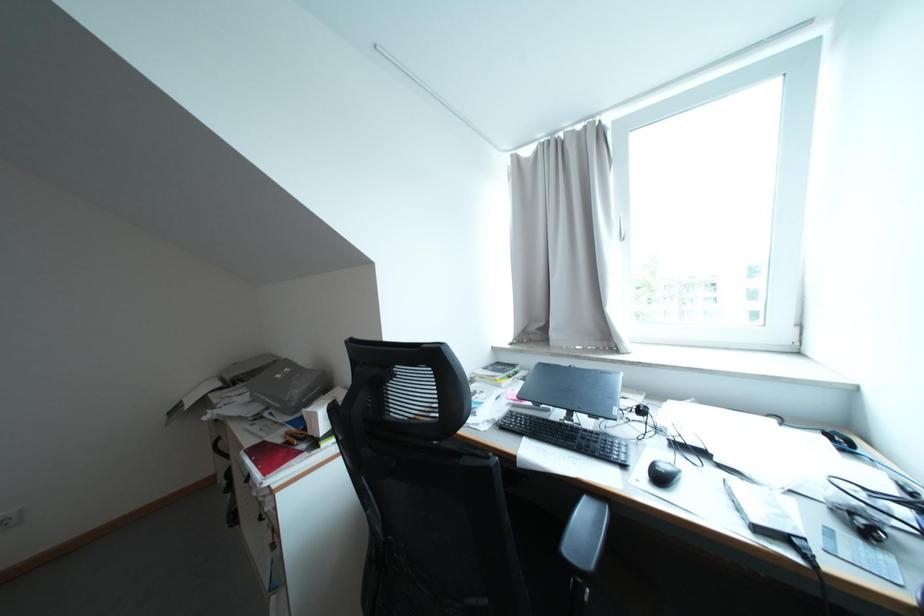
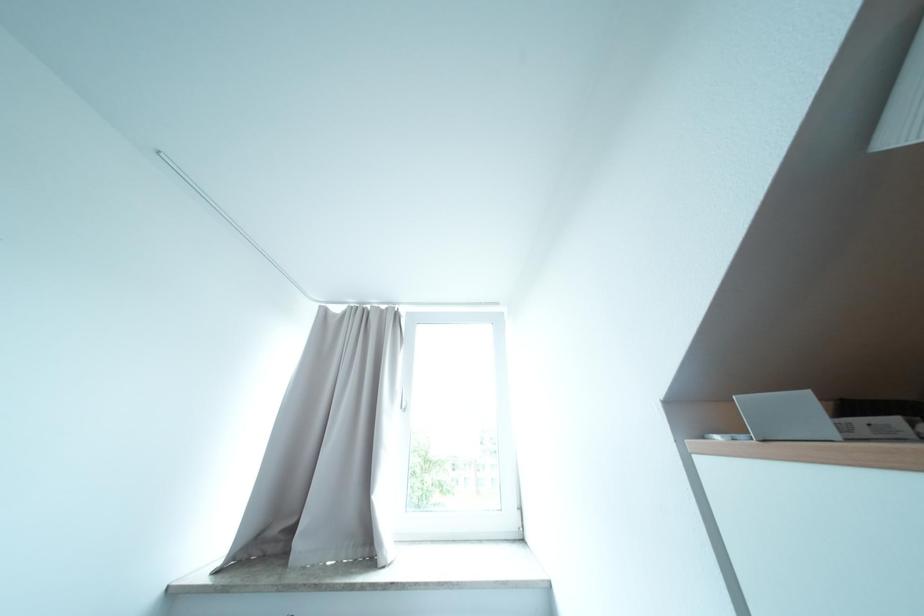
The first image is from the beginning of the video and the second image is from the end. How did the camera likely rotate when shooting the video?

The camera's rotation is toward right-up.